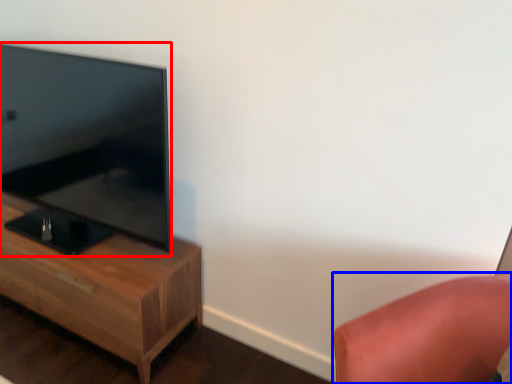
Question: Which point is closer to the camera, television (highlighted by a red box) or furniture (highlighted by a blue box)?

Choices:
 (A) television
 (B) furniture

Answer: (B)